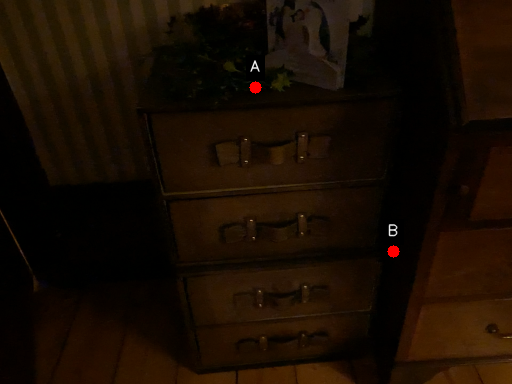
Question: Two points are circled on the image, labeled by A and B beside each circle. Which point appears closest to the camera in this image?

Choices:
 (A) A is closer
 (B) B is closer

Answer: (A)